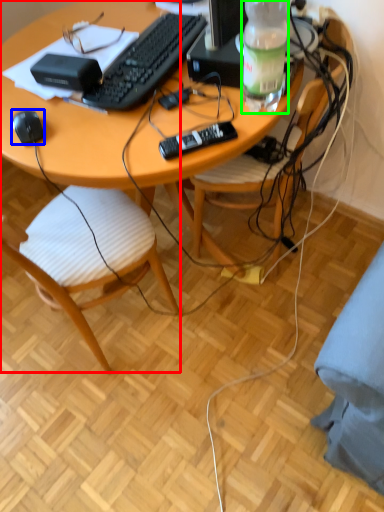
Question: Estimate the real-world distances between objects in this image. Which object is farther from chair (highlighted by a red box), computer mouse (highlighted by a blue box) or bottle (highlighted by a green box)?

Choices:
 (A) computer mouse
 (B) bottle

Answer: (B)